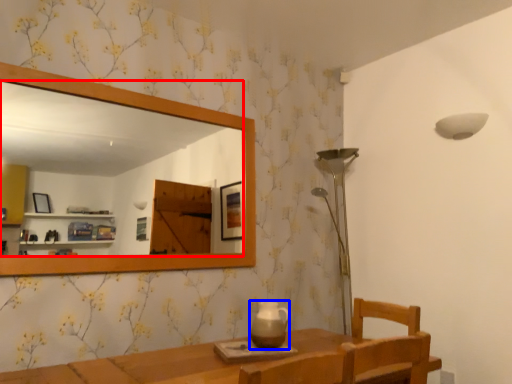
Question: Which of the following is the closest to the observer, mirror (highlighted by a red box) or tea pot (highlighted by a blue box)?

Choices:
 (A) mirror
 (B) tea pot

Answer: (A)